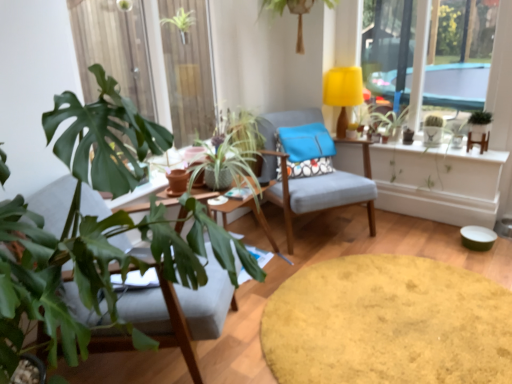
Question: Is green leafy plant at upper center, which appears as the third houseplant when viewed from the left, inside wooden round table at center, the 1th round table in the top-to-bottom sequence?

Choices:
 (A) no
 (B) yes

Answer: (A)

Question: Is wooden round table at center, the second round table ordered from the bottom, far away from green leafy plant at upper center, marked as the 3th houseplant in a right-to-left arrangement?

Choices:
 (A) yes
 (B) no

Answer: (A)

Question: Is the depth of wooden round table at center, the second round table ordered from the bottom, less than that of green leafy plant at upper center, marked as the 3th houseplant in a right-to-left arrangement?

Choices:
 (A) yes
 (B) no

Answer: (A)

Question: Is wooden round table at center, the 1th round table in the top-to-bottom sequence, looking in the opposite direction of green leafy plant at upper center, which appears as the third houseplant when viewed from the left?

Choices:
 (A) no
 (B) yes

Answer: (A)

Question: Is wooden round table at center, the 1th round table in the top-to-bottom sequence, smaller than green leafy plant at upper center, marked as the 3th houseplant in a right-to-left arrangement?

Choices:
 (A) no
 (B) yes

Answer: (A)

Question: Is green matte cactus at upper right, which is counted as the fourth houseplant, starting from the left, taller or shorter than green leafy plant at center, the fourth houseplant when ordered from right to left?

Choices:
 (A) short
 (B) tall

Answer: (A)

Question: Looking at the image, does green matte cactus at upper right, which is counted as the fourth houseplant, starting from the left, seem bigger or smaller compared to green leafy plant at center, the fourth houseplant when ordered from right to left?

Choices:
 (A) big
 (B) small

Answer: (B)

Question: From a real-world perspective, relative to green leafy plant at center, arranged as the 2th houseplant when viewed from the left, is green matte cactus at upper right, which ranks as the second houseplant in right-to-left order, vertically above or below?

Choices:
 (A) below
 (B) above

Answer: (B)

Question: Is point (438, 135) positioned closer to the camera than point (228, 152)?

Choices:
 (A) farther
 (B) closer

Answer: (A)

Question: From a real-world perspective, is green matte plant at upper right physically located above or below matte gray chair at center, the second chair from the right?

Choices:
 (A) above
 (B) below

Answer: (A)

Question: Relative to matte gray chair at center, the second chair from the right, is green matte plant at upper right in front or behind?

Choices:
 (A) behind
 (B) front

Answer: (A)

Question: Is green matte plant at upper right wider or thinner than matte gray chair at center, the 1th chair positioned from the front?

Choices:
 (A) wide
 (B) thin

Answer: (B)

Question: Is green matte plant at upper right situated inside matte gray chair at center, the second chair from the right, or outside?

Choices:
 (A) outside
 (B) inside

Answer: (A)

Question: Considering their positions, is green matte cactus at upper right, which is counted as the fourth houseplant, starting from the left, located in front of or behind green matte plant at upper right?

Choices:
 (A) front
 (B) behind

Answer: (A)

Question: In terms of size, does green matte cactus at upper right, which ranks as the second houseplant in right-to-left order, appear bigger or smaller than green matte plant at upper right?

Choices:
 (A) small
 (B) big

Answer: (A)